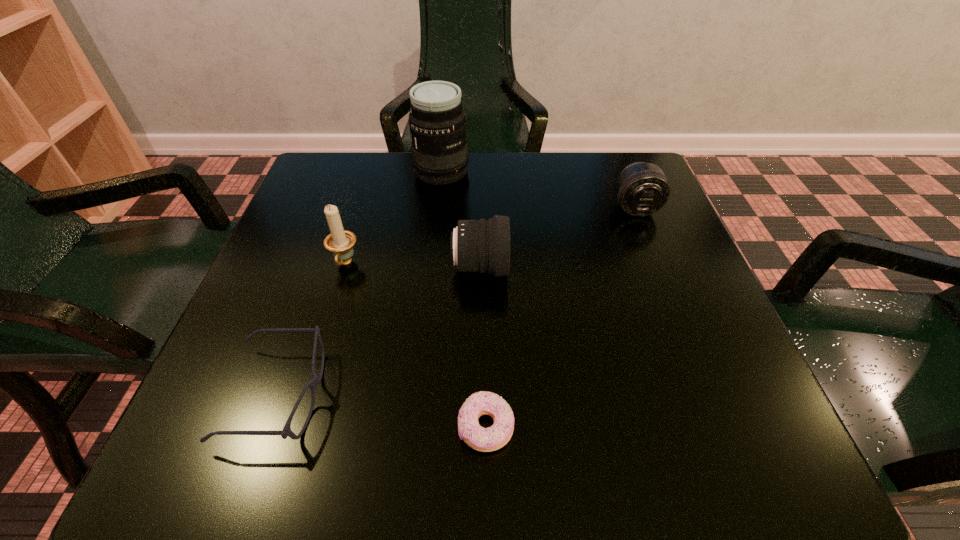
This screenshot has width=960, height=540. I want to click on the tallest telephoto lens, so click(x=437, y=123).

The width and height of the screenshot is (960, 540). I want to click on the farthest telephoto lens, so click(x=437, y=123).

Identify the location of candle_holder. (340, 242).

Find the location of `the nearest telephoto lens`. the nearest telephoto lens is located at coordinates (481, 245).

At what (x,y) coordinates should I click in order to perform the action: click on the rightmost object. Please return your answer as a coordinate pair (x, y). The width and height of the screenshot is (960, 540). Looking at the image, I should click on (642, 189).

You are a GUI agent. You are given a task and a screenshot of the screen. Output one action in this format:
    pyautogui.click(x=<x>, y=<y>)
    Task: Click on the rightmost telephoto lens
    The height and width of the screenshot is (540, 960).
    Given the screenshot: What is the action you would take?
    click(642, 189)

The width and height of the screenshot is (960, 540). What are the coordinates of `the fifth tallest object` in the screenshot? It's located at (286, 431).

Find the location of a particular element. Image resolution: width=960 pixels, height=540 pixels. doughnut is located at coordinates (482, 439).

Find the location of a particular element. free space located 0.140m on the right of the tallest object is located at coordinates [x=526, y=172].

Locate an element on the screen. vacant space positioned 0.360m on the handle side of the fifth shortest object is located at coordinates (281, 474).